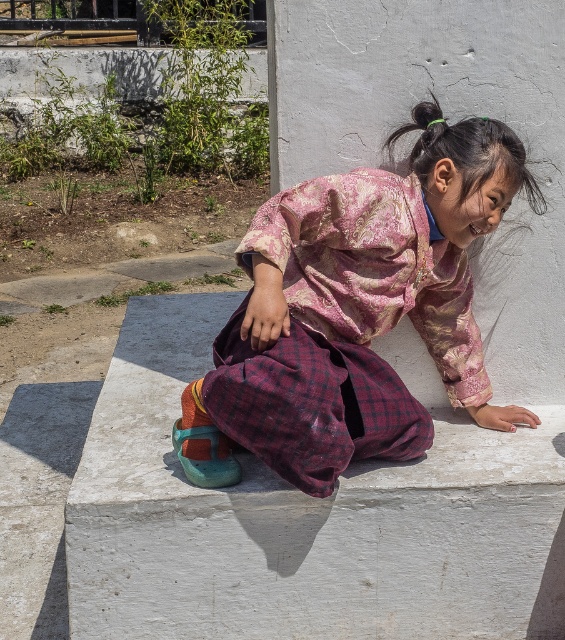
Question: Which of the following is the closest to the observer?

Choices:
 (A) (410, 608)
 (B) (350, 168)

Answer: (A)

Question: Which of the following is the closest to the observer?

Choices:
 (A) plaid fabric pants at center
 (B) white smooth concrete at center
 (C) white concrete at center

Answer: (A)

Question: Can you confirm if plaid fabric pants at center is wider than white smooth concrete at center?

Choices:
 (A) no
 (B) yes

Answer: (B)

Question: Estimate the real-world distances between objects in this image. Which object is farther from the white smooth concrete at center?

Choices:
 (A) plaid fabric pants at center
 (B) white concrete at center

Answer: (B)

Question: Does white concrete at center have a smaller size compared to plaid fabric pants at center?

Choices:
 (A) no
 (B) yes

Answer: (A)

Question: Where is white concrete at center located in relation to plaid fabric pants at center in the image?

Choices:
 (A) below
 (B) above

Answer: (A)